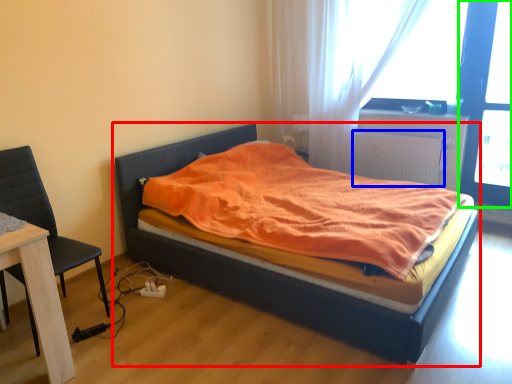
Question: Based on their relative distances, which object is nearer to bed (highlighted by a red box)? Choose from radiator (highlighted by a blue box) and screen door (highlighted by a green box).

Choices:
 (A) radiator
 (B) screen door

Answer: (A)